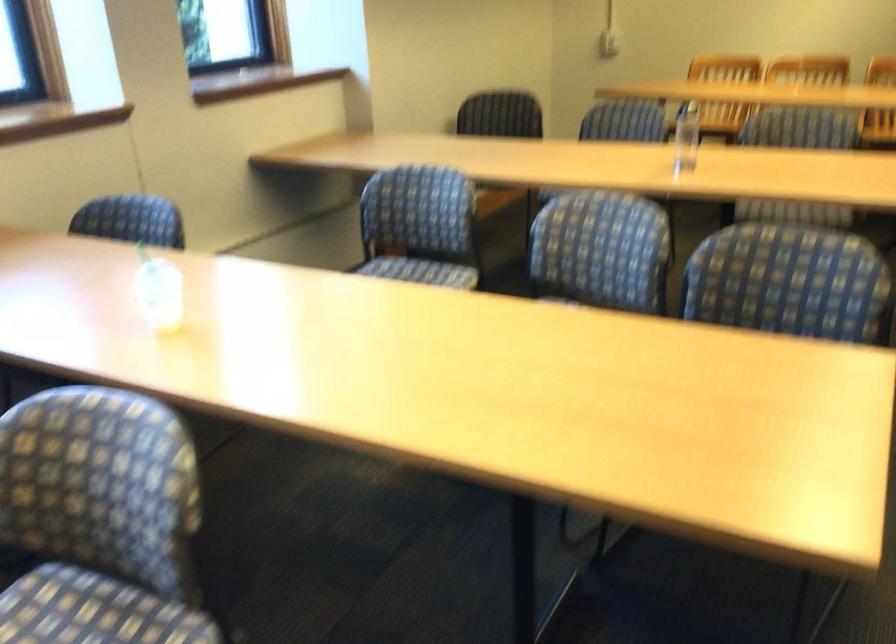
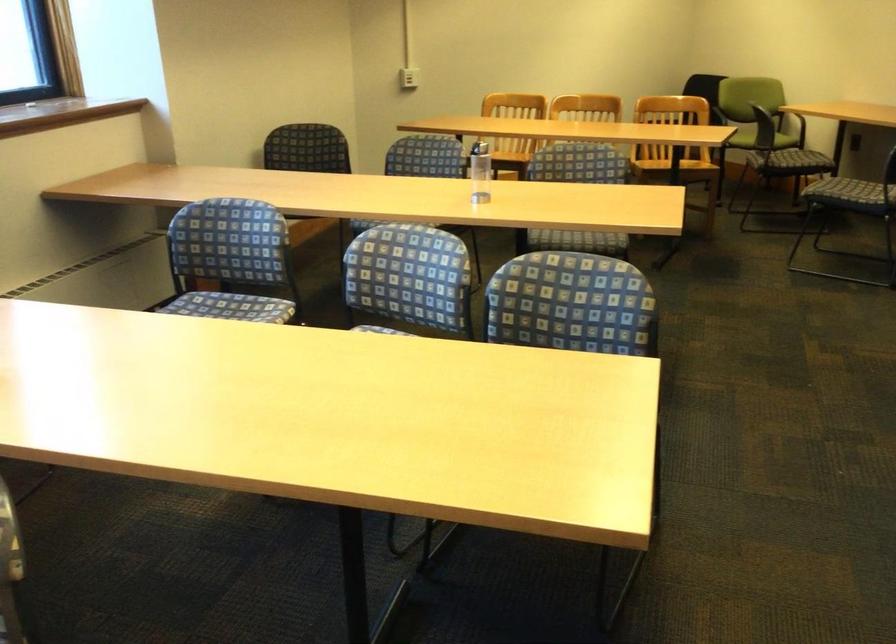
Question: The camera is either moving clockwise (left) or counter-clockwise (right) around the object. The first image is from the beginning of the video and the second image is from the end. Is the camera moving left or right when shooting the video?

Choices:
 (A) Left
 (B) Right

Answer: (A)